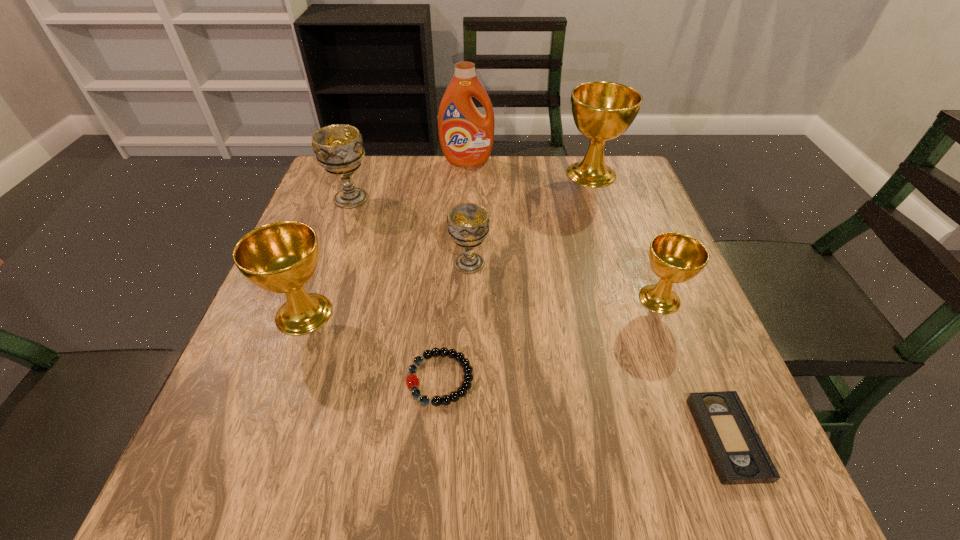
Locate an element on the screen. The image size is (960, 540). videotape is located at coordinates (737, 452).

Identify the location of blank area located 0.400m on the front-facing side of the tallest object. (463, 261).

Find the location of a particular element. This screenshot has height=540, width=960. blank area located 0.140m on the front of the seventh shortest object is located at coordinates (608, 224).

Where is `free region located on the right of the bigger white chalice`? free region located on the right of the bigger white chalice is located at coordinates (502, 198).

Identify the location of free spot located 0.170m on the back of the leftmost gold chalice. The width and height of the screenshot is (960, 540). tap(332, 237).

You are a GUI agent. You are given a task and a screenshot of the screen. Output one action in this format:
    pyautogui.click(x=<x>, y=<y>)
    Task: Click on the vacant region located 0.080m on the left of the nearer white chalice
    
    Given the screenshot: What is the action you would take?
    pyautogui.click(x=414, y=264)

Find the location of `free region located 0.150m on the left of the smallest gold chalice`. free region located 0.150m on the left of the smallest gold chalice is located at coordinates (562, 299).

The width and height of the screenshot is (960, 540). Find the location of `free location located on the right of the bracelet`. free location located on the right of the bracelet is located at coordinates tap(514, 379).

You are a GUI agent. You are given a task and a screenshot of the screen. Output one action in this format:
    pyautogui.click(x=<x>, y=<y>)
    Task: Click on the free region located 0.190m on the back of the videotape
    This screenshot has width=960, height=540.
    Given the screenshot: What is the action you would take?
    pyautogui.click(x=675, y=312)

Find the location of a particular element. The image size is (960, 540). detergent present at the far edge is located at coordinates (466, 136).